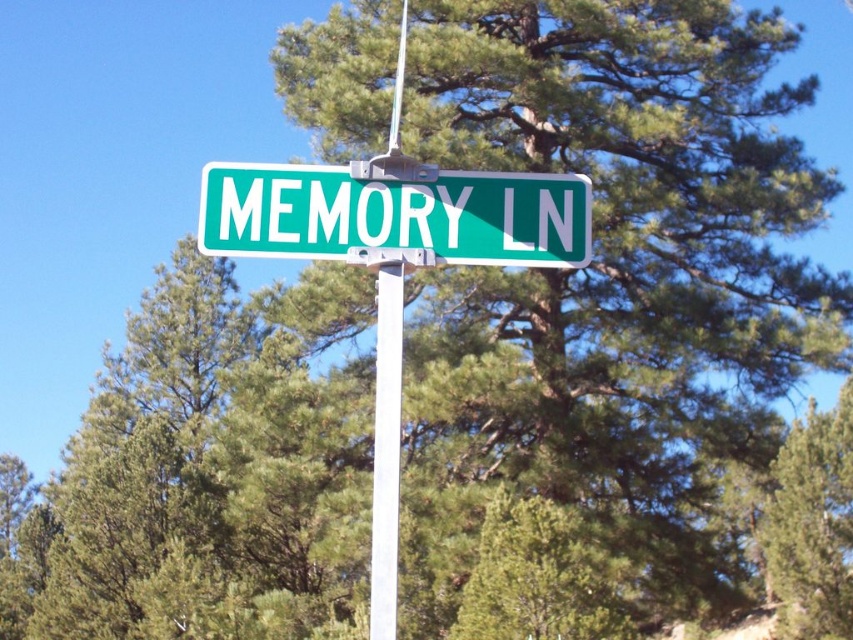
Question: Is green metallic street sign at center positioned behind white smooth pole at center?

Choices:
 (A) no
 (B) yes

Answer: (B)

Question: Does green metallic street sign at center appear over white smooth pole at center?

Choices:
 (A) yes
 (B) no

Answer: (A)

Question: Does green metallic street sign at center appear on the left side of white smooth pole at center?

Choices:
 (A) no
 (B) yes

Answer: (A)

Question: Which of the following is the closest to the observer?

Choices:
 (A) (376, 336)
 (B) (373, 204)

Answer: (B)

Question: Which point is closer to the camera?

Choices:
 (A) (378, 216)
 (B) (381, 524)

Answer: (B)